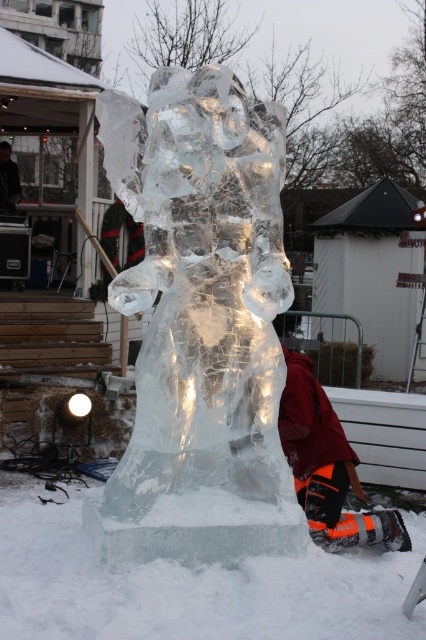
Does clear ice sculpture at center have a lesser height compared to orange snow pants at lower right?

Incorrect, clear ice sculpture at center's height does not fall short of orange snow pants at lower right's.

Can you confirm if clear ice sculpture at center is thinner than orange snow pants at lower right?

No, clear ice sculpture at center is not thinner than orange snow pants at lower right.

The image size is (426, 640). I want to click on clear ice sculpture at center, so click(201, 324).